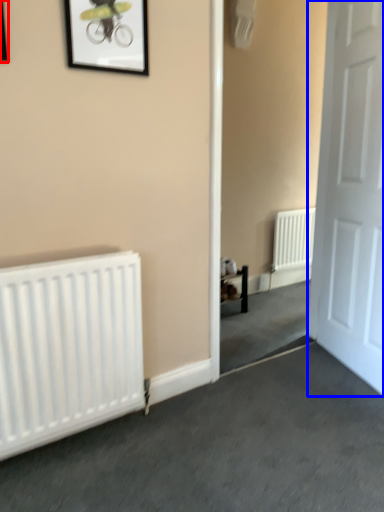
Question: Which object is further to the camera taking this photo, picture frame (highlighted by a red box) or door (highlighted by a blue box)?

Choices:
 (A) picture frame
 (B) door

Answer: (B)